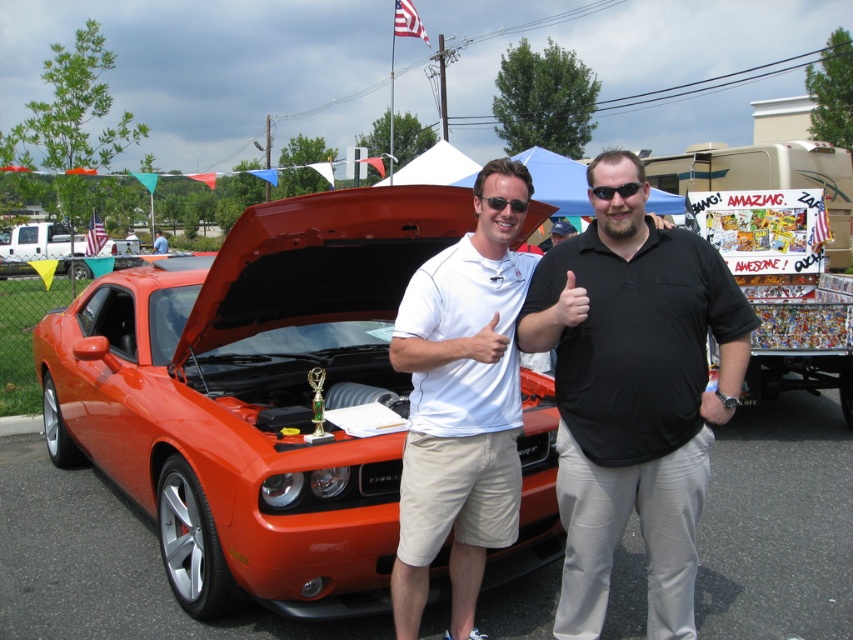
Between white cotton polo shirt at center and sunglasses at center, which one appears on the right side from the viewer's perspective?

sunglasses at center

At what (x,y) coordinates should I click in order to perform the action: click on white cotton polo shirt at center. Please return your answer as a coordinate pair (x, y). The image size is (853, 640). Looking at the image, I should click on (461, 404).

Find the location of a particular element. white cotton polo shirt at center is located at coordinates (461, 404).

Does orange matte car at center have a lesser width compared to black matte shirt at center?

No.

Does orange matte car at center have a lesser height compared to black matte shirt at center?

No.

Is point (310, 390) more distant than point (563, 230)?

No, (310, 390) is closer to viewer.

In order to click on orange matte car at center in this screenshot , I will do `click(253, 396)`.

Does orange matte car at center lie behind matte white shirt at center?

Yes, it is.

You are a GUI agent. You are given a task and a screenshot of the screen. Output one action in this format:
    pyautogui.click(x=<x>, y=<y>)
    Task: Click on the orange matte car at center
    This screenshot has width=853, height=640.
    Given the screenshot: What is the action you would take?
    pyautogui.click(x=253, y=396)

This screenshot has width=853, height=640. I want to click on orange matte car at center, so click(x=253, y=396).